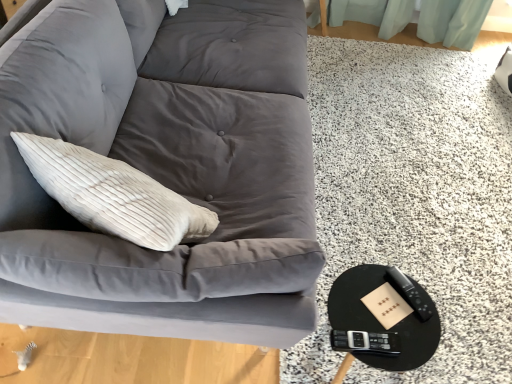
This screenshot has width=512, height=384. I want to click on empty space that is ontop of black glossy round table at lower right (from a real-world perspective), so click(386, 311).